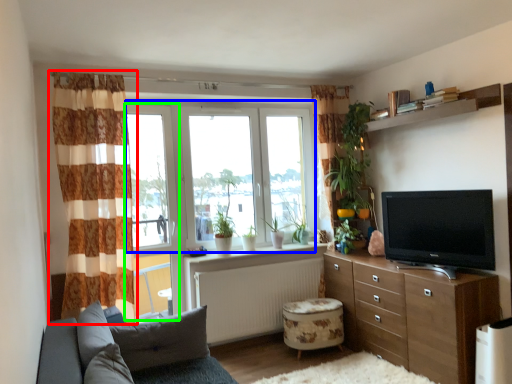
Question: Which object is the closest to the curtain (highlighted by a red box)? Choose among these: window screen (highlighted by a blue box) or window frame (highlighted by a green box).

Choices:
 (A) window screen
 (B) window frame

Answer: (B)